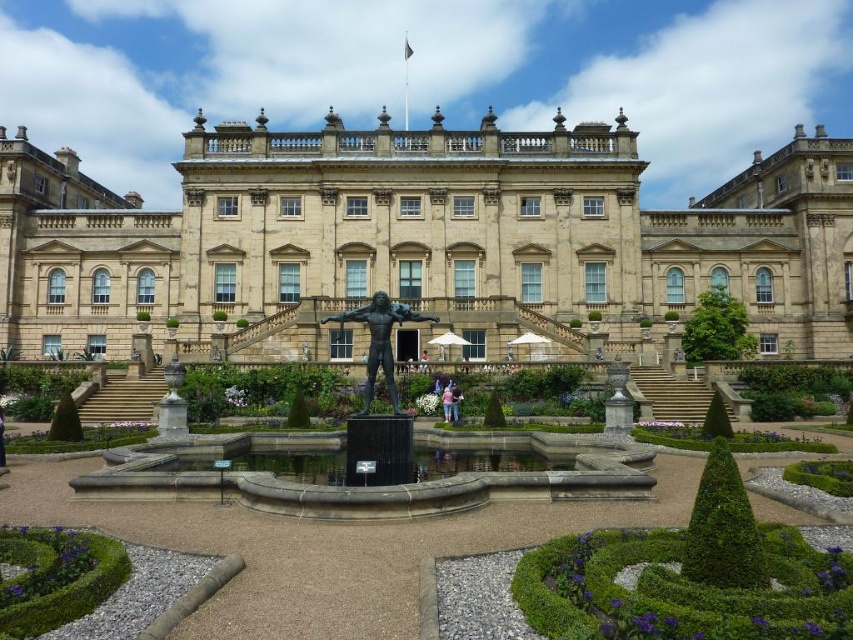
You are planning to place a new decorative item in the garden between the bronze statue at center and the pink fabric person at center. Which object should you move to ensure there is enough space for the new item?

You should move the bronze statue at center because it might be wider than the pink fabric person at center, so moving the larger one would create more space.

You are standing at the entrance of the grand classical building and see the bronze statue at center and the light blue denim jeans at center. You want to place a decorative pot between them. How far apart should you position the pot from each object to ensure it is exactly halfway between them?

The bronze statue at center is 10.00 meters away from the light blue denim jeans at center. To place the decorative pot exactly halfway between them, position it 5.00 meters away from each object.